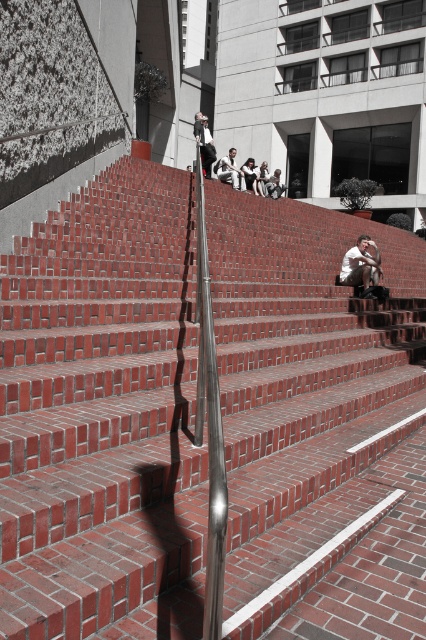
Does matte white shirt at center appear over white shirt at upper center?

Actually, matte white shirt at center is below white shirt at upper center.

Locate an element on the screen. Image resolution: width=426 pixels, height=640 pixels. matte white shirt at center is located at coordinates pyautogui.click(x=360, y=266).

Can you confirm if matte white shirt at center is positioned above white cotton shirt at center?

Actually, matte white shirt at center is below white cotton shirt at center.

In the scene shown: Does matte white shirt at center appear under white cotton shirt at center?

Yes, matte white shirt at center is below white cotton shirt at center.

The height and width of the screenshot is (640, 426). What do you see at coordinates (360, 266) in the screenshot?
I see `matte white shirt at center` at bounding box center [360, 266].

I want to click on matte white shirt at center, so click(x=360, y=266).

Where is `white shirt at upper center`? The height and width of the screenshot is (640, 426). white shirt at upper center is located at coordinates (204, 141).

Looking at this image, who is shorter, white shirt at upper center or white cotton shirt at center?

With less height is white cotton shirt at center.

The width and height of the screenshot is (426, 640). Identify the location of white shirt at upper center. (204, 141).

Image resolution: width=426 pixels, height=640 pixels. What are the coordinates of `white shirt at upper center` in the screenshot? It's located at (204, 141).